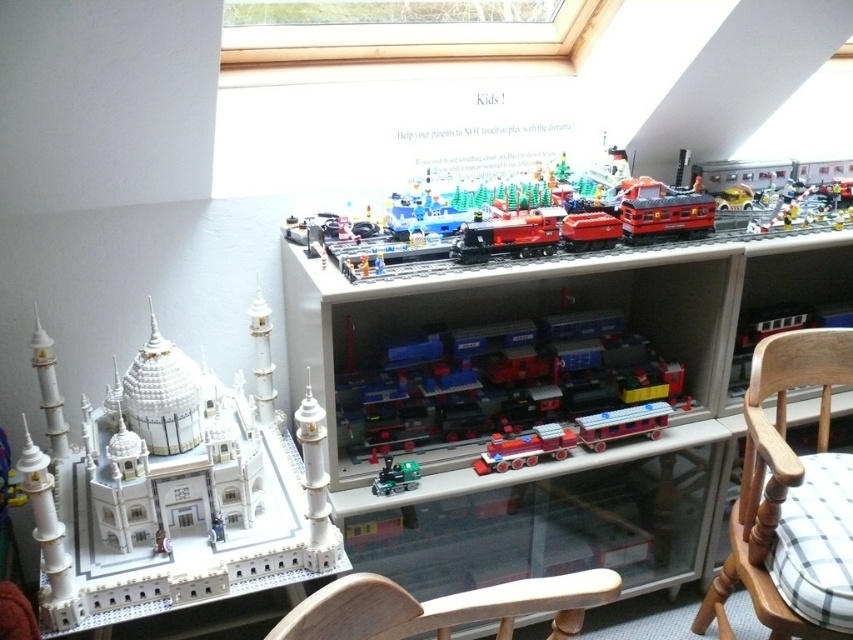
Question: Which of the following is the farthest from the observer?

Choices:
 (A) (386, 456)
 (B) (538, 241)

Answer: (A)

Question: Which point appears farthest from the camera in this image?

Choices:
 (A) (679, 186)
 (B) (776, 632)
 (C) (604, 579)

Answer: (A)

Question: Is wooden chair at lower center smaller than green metallic train at center?

Choices:
 (A) yes
 (B) no

Answer: (B)

Question: Is red plastic train at center to the right of wooden chair at lower center from the viewer's perspective?

Choices:
 (A) yes
 (B) no

Answer: (A)

Question: Does white glossy lego taj mahal at lower left appear on the right side of wooden chair at lower right?

Choices:
 (A) no
 (B) yes

Answer: (A)

Question: Which object is positioned closest to the brick red plastic train set at upper center?

Choices:
 (A) shiny red train at center
 (B) green metallic train at center
 (C) red plastic train at center
 (D) wooden chair at lower right

Answer: (C)